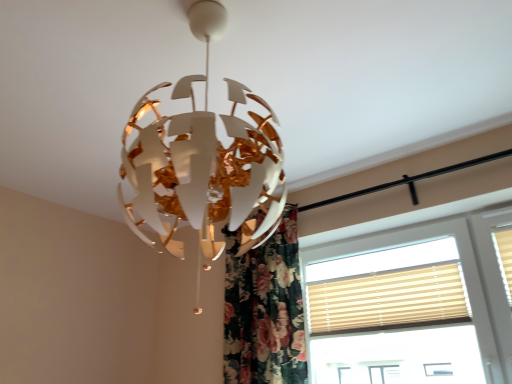
Question: From the image's perspective, is floral fabric curtain at center beneath beige fabric window at right?

Choices:
 (A) yes
 (B) no

Answer: (A)

Question: Is floral fabric curtain at center aimed at beige fabric window at right?

Choices:
 (A) no
 (B) yes

Answer: (A)

Question: Is floral fabric curtain at center wider than beige fabric window at right?

Choices:
 (A) no
 (B) yes

Answer: (B)

Question: Is floral fabric curtain at center directly adjacent to beige fabric window at right?

Choices:
 (A) no
 (B) yes

Answer: (A)

Question: Is beige fabric window at right completely or partially inside floral fabric curtain at center?

Choices:
 (A) yes
 (B) no

Answer: (B)

Question: Considering the positions of point (439, 296) and point (274, 380), is point (439, 296) closer or farther from the camera than point (274, 380)?

Choices:
 (A) farther
 (B) closer

Answer: (B)

Question: From the image's perspective, is beige fabric blinds at right located above or below floral fabric curtain at center?

Choices:
 (A) above
 (B) below

Answer: (B)

Question: Is beige fabric blinds at right bigger or smaller than floral fabric curtain at center?

Choices:
 (A) small
 (B) big

Answer: (A)

Question: Considering the positions of beige fabric blinds at right and floral fabric curtain at center in the image, is beige fabric blinds at right wider or thinner than floral fabric curtain at center?

Choices:
 (A) wide
 (B) thin

Answer: (B)

Question: Is point click(x=251, y=302) closer or farther from the camera than point click(x=309, y=316)?

Choices:
 (A) farther
 (B) closer

Answer: (B)

Question: From the image's perspective, is floral fabric curtain at center positioned above or below beige fabric window at right?

Choices:
 (A) above
 (B) below

Answer: (B)

Question: Considering their positions, is floral fabric curtain at center located in front of or behind beige fabric window at right?

Choices:
 (A) behind
 (B) front

Answer: (A)

Question: Which is correct: floral fabric curtain at center is inside beige fabric window at right, or outside of it?

Choices:
 (A) inside
 (B) outside

Answer: (B)

Question: Based on their positions, is floral fabric curtain at center located to the left or right of beige fabric blinds at right?

Choices:
 (A) left
 (B) right

Answer: (A)

Question: Considering the positions of floral fabric curtain at center and beige fabric blinds at right in the image, is floral fabric curtain at center taller or shorter than beige fabric blinds at right?

Choices:
 (A) short
 (B) tall

Answer: (B)